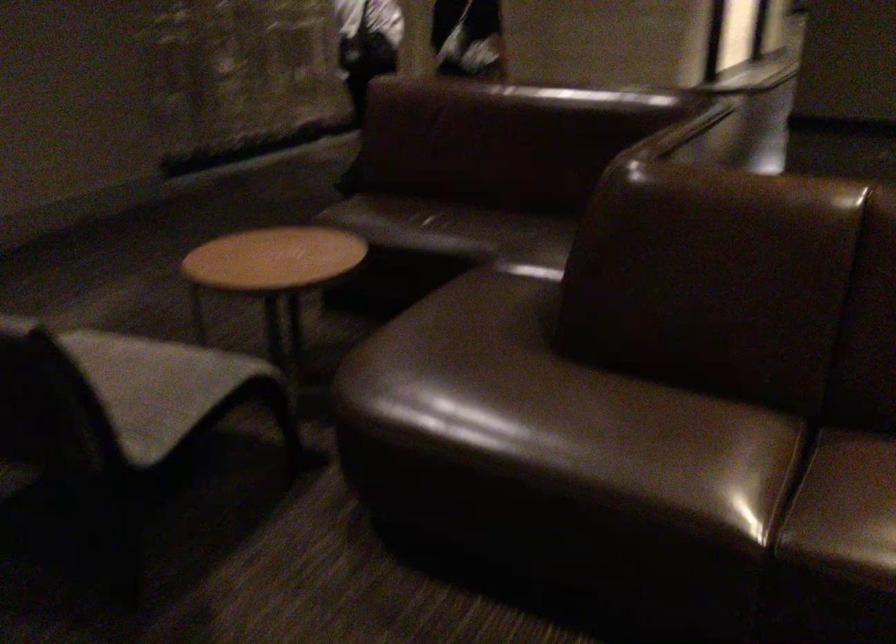
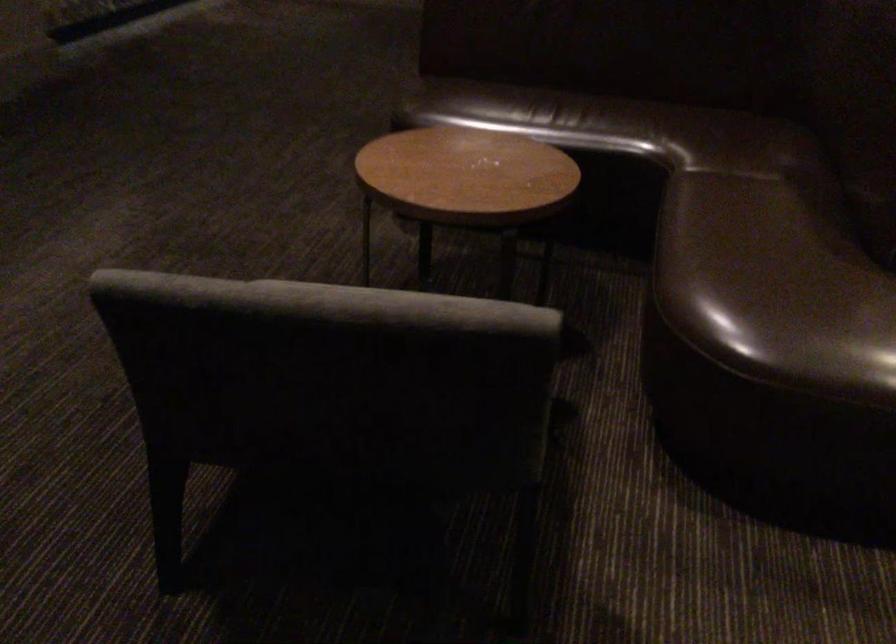
In the second image, find the point that corresponds to (420,348) in the first image.

(772, 276)